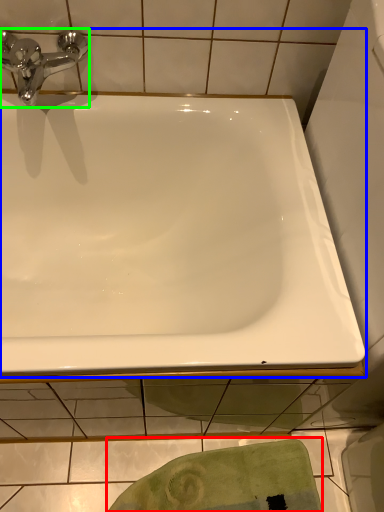
Question: Which is farther away from bath towel (highlighted by a red box)? bathtub (highlighted by a blue box) or tap (highlighted by a green box)?

Choices:
 (A) bathtub
 (B) tap

Answer: (B)